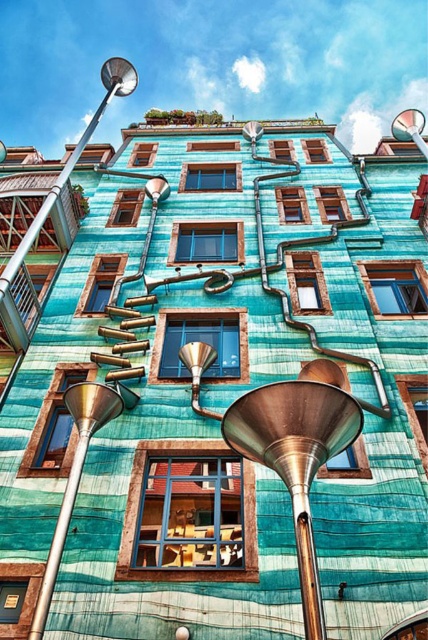
Which is above, metallic teal funnel at center or brass/bronze funnel at center?

brass/bronze funnel at center is higher up.

Is metallic teal funnel at center taller than brass/bronze funnel at center?

Correct, metallic teal funnel at center is much taller as brass/bronze funnel at center.

The image size is (428, 640). I want to click on metallic teal funnel at center, so click(296, 458).

Who is taller, satin gold funnel at lower left or brass/bronze funnel at center?

brass/bronze funnel at center

The width and height of the screenshot is (428, 640). Find the location of `satin gold funnel at lower left`. satin gold funnel at lower left is located at coordinates (74, 477).

Is point (47, 579) more distant than point (204, 352)?

No, it is not.

Find the location of `satin gold funnel at lower left`. satin gold funnel at lower left is located at coordinates (74, 477).

Who is taller, metallic teal funnel at center or satin gold funnel at lower left?

Standing taller between the two is metallic teal funnel at center.

Is point (296, 435) positioned in front of point (68, 493)?

That is True.

At what (x,y) coordinates should I click in order to perform the action: click on metallic teal funnel at center. Please return your answer as a coordinate pair (x, y). This screenshot has width=428, height=640. Looking at the image, I should click on (296, 458).